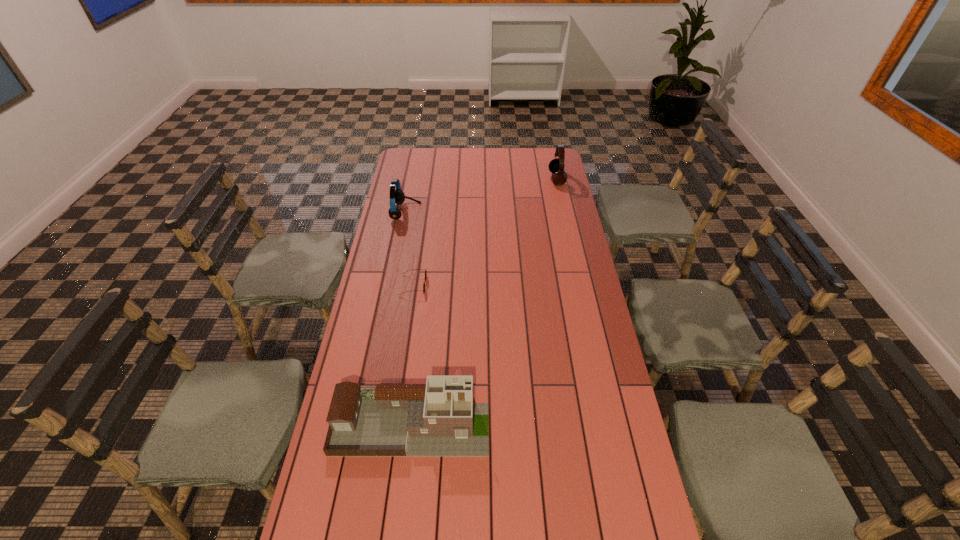
The height and width of the screenshot is (540, 960). Identify the location of free spot between the sunglasses and the dollhouse. (412, 355).

Where is `empty space between the shortest object and the nearest object`? This screenshot has height=540, width=960. empty space between the shortest object and the nearest object is located at coordinates (412, 355).

Identify which object is the closest to the dollhouse. Please provide its 2D coordinates. Your answer should be formatted as a tuple, i.e. [(x, y)], where the tuple contains the x and y coordinates of a point satisfying the conditions above.

[(425, 269)]

The height and width of the screenshot is (540, 960). Identify the location of the closest object to the third farthest object. (397, 196).